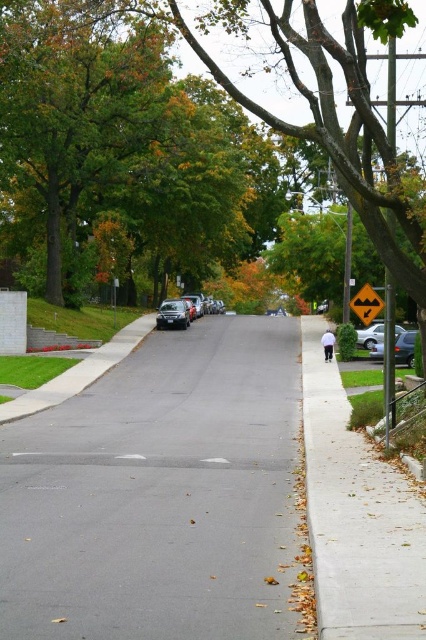
You are a delivery person trying to park your van on the gray concrete sidewalk at right. The shiny silver sedan at center is blocking the entrance to the sidewalk. Can you drive around the sedan to access the sidewalk?

The gray concrete sidewalk at right is positioned under the shiny silver sedan at center, meaning the sedan is directly in front of the sidewalk. This blocks access, so you cannot drive around it to reach the sidewalk.

You are driving a car and want to pass the shiny black sedan at center and the silver metallic sedan at right. Which car should you pass first?

You should pass the shiny black sedan at center first because it is closer to you than the silver metallic sedan at right.

You are a pedestrian standing on the gray concrete sidewalk at right and want to walk to the green leafy tree at center. Which direction should you move to reach it?

The green leafy tree at center is larger in size than the gray concrete sidewalk at right, but to reach it from the sidewalk, you should move towards the center of the street where the tree is located.